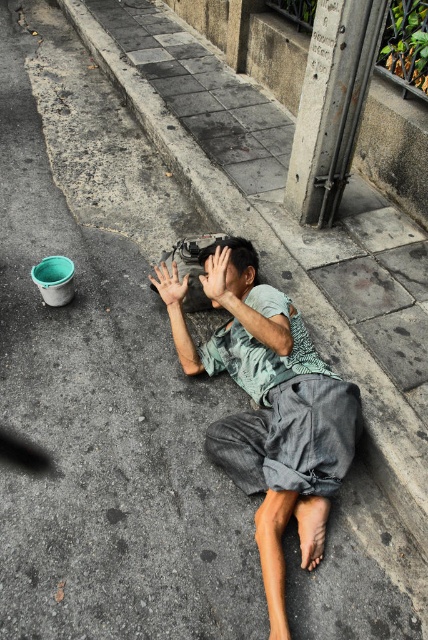
Between gray cotton shirt at center and smooth skin hand at center, which one is positioned higher?

Positioned higher is smooth skin hand at center.

Is point (294, 499) positioned before point (172, 296)?

Yes.

Identify the location of gray cotton shirt at center. This screenshot has width=428, height=640. (275, 417).

Who is lower down, dark skin hand at center or smooth skin hand at center?

Positioned lower is dark skin hand at center.

Is dark skin hand at center further to camera compared to smooth skin hand at center?

No, dark skin hand at center is closer to the viewer.

The image size is (428, 640). I want to click on dark skin hand at center, so click(x=217, y=278).

Identify the location of dark skin hand at center. (217, 278).

Which is in front, point (323, 531) or point (205, 268)?

Point (323, 531)

Between point (265, 573) and point (214, 305), which one is positioned behind?

The point (214, 305) is more distant.

Locate an element on the screen. This screenshot has width=428, height=640. gray cotton shirt at center is located at coordinates (275, 417).